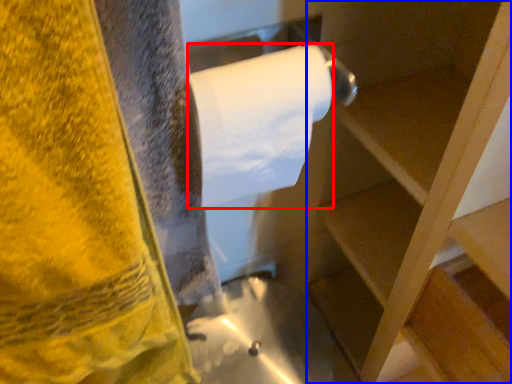
Question: Among these objects, which one is farthest to the camera, toilet paper (highlighted by a red box) or shelf (highlighted by a blue box)?

Choices:
 (A) toilet paper
 (B) shelf

Answer: (A)